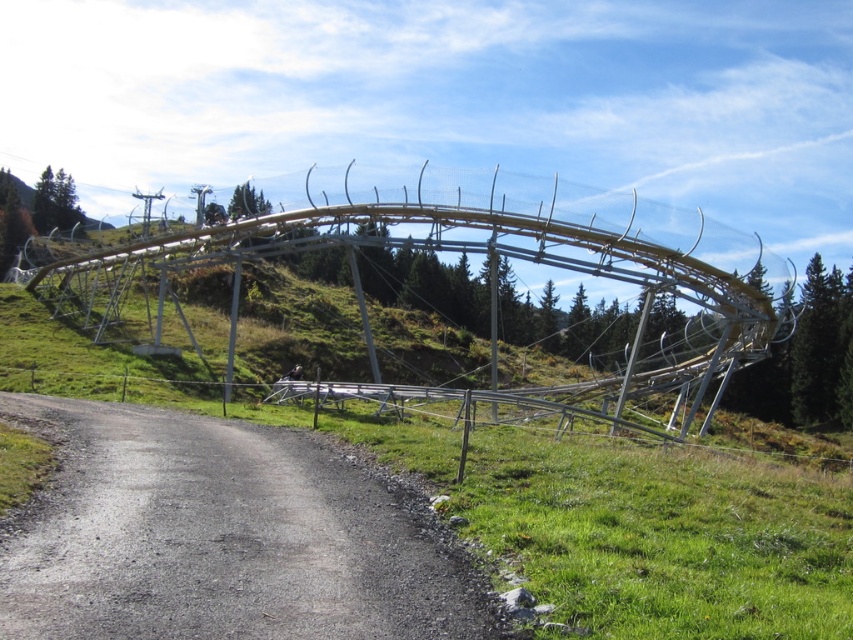
Question: Is gray asphalt road at lower left above metallic silver roller coaster at center?

Choices:
 (A) no
 (B) yes

Answer: (A)

Question: Which point is farther from the camera taking this photo?

Choices:
 (A) (753, 252)
 (B) (206, 422)

Answer: (A)

Question: Which object appears closest to the camera in this image?

Choices:
 (A) gray asphalt road at lower left
 (B) metallic silver roller coaster at center

Answer: (A)

Question: Does gray asphalt road at lower left appear over metallic silver roller coaster at center?

Choices:
 (A) yes
 (B) no

Answer: (B)

Question: Does gray asphalt road at lower left appear over metallic silver roller coaster at center?

Choices:
 (A) no
 (B) yes

Answer: (A)